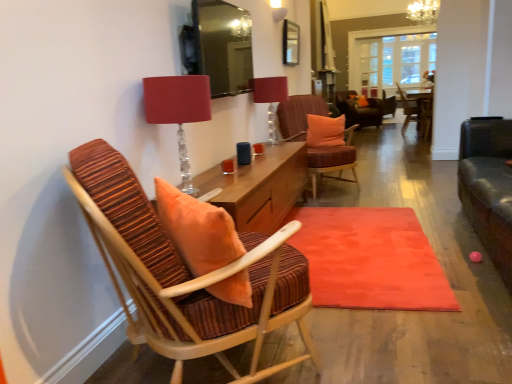
Question: Considering the relative sizes of clear glass door at center and wooden chair with striped cushion at center, arranged as the fourth chair when viewed from the front, in the image provided, is clear glass door at center thinner than wooden chair with striped cushion at center, arranged as the fourth chair when viewed from the front,?

Choices:
 (A) no
 (B) yes

Answer: (B)

Question: Considering the relative sizes of clear glass door at center and wooden chair with striped cushion at center, which is the 4th chair in left-to-right order, in the image provided, is clear glass door at center smaller than wooden chair with striped cushion at center, which is the 4th chair in left-to-right order,?

Choices:
 (A) no
 (B) yes

Answer: (A)

Question: Is clear glass door at center touching wooden chair with striped cushion at center, arranged as the fourth chair when viewed from the front?

Choices:
 (A) yes
 (B) no

Answer: (B)

Question: From the image's perspective, is clear glass door at center above wooden chair with striped cushion at center, marked as the second chair in a back-to-front arrangement?

Choices:
 (A) yes
 (B) no

Answer: (A)

Question: Can you confirm if clear glass door at center is wider than wooden chair with striped cushion at center, which is the 4th chair in left-to-right order?

Choices:
 (A) no
 (B) yes

Answer: (A)

Question: Is point (407, 102) positioned closer to the camera than point (286, 77)?

Choices:
 (A) closer
 (B) farther

Answer: (B)

Question: From the image's perspective, relative to matte glass table lamp at upper center, the 1th table lamp positioned from the right, is wooden chair with striped cushion at center, marked as the second chair in a back-to-front arrangement, above or below?

Choices:
 (A) below
 (B) above

Answer: (B)

Question: Considering the positions of wooden chair with striped cushion at center, acting as the 2th chair starting from the right, and matte glass table lamp at upper center, the 2th table lamp positioned from the front, in the image, is wooden chair with striped cushion at center, acting as the 2th chair starting from the right, wider or thinner than matte glass table lamp at upper center, the 2th table lamp positioned from the front,?

Choices:
 (A) wide
 (B) thin

Answer: (A)

Question: From a real-world perspective, is wooden chair with striped cushion at center, arranged as the fourth chair when viewed from the front, above or below matte glass table lamp at upper center, the first table lamp when ordered from back to front?

Choices:
 (A) above
 (B) below

Answer: (B)

Question: Is point (426, 107) positioned closer to the camera than point (159, 278)?

Choices:
 (A) closer
 (B) farther

Answer: (B)

Question: Visually, is wooden chair with striped upholstery at center, the third chair positioned from the back, positioned to the left or to the right of striped fabric chair at left, the 1th chair viewed from the left?

Choices:
 (A) right
 (B) left

Answer: (A)

Question: In terms of size, does wooden chair with striped upholstery at center, acting as the 1th chair starting from the right, appear bigger or smaller than striped fabric chair at left, the first chair from the front?

Choices:
 (A) big
 (B) small

Answer: (B)

Question: From the image's perspective, is wooden chair with striped upholstery at center, the 5th chair viewed from the left, located above or below striped fabric chair at left, which appears as the fifth chair when viewed from the right?

Choices:
 (A) below
 (B) above

Answer: (B)

Question: Does point (412, 256) appear closer or farther from the camera than point (429, 139)?

Choices:
 (A) closer
 (B) farther

Answer: (A)

Question: From the image's perspective, is matte orange rug at center located above or below wooden chair with striped upholstery at center, the 5th chair viewed from the left?

Choices:
 (A) below
 (B) above

Answer: (A)